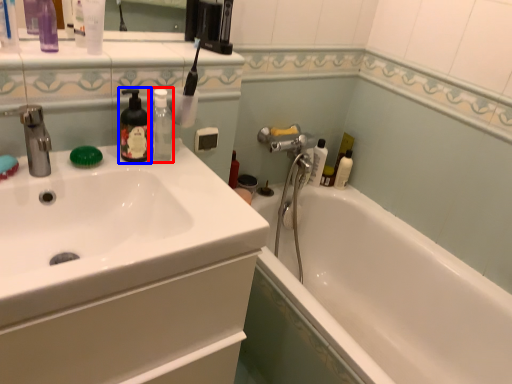
Question: Which object appears closest to the camera in this image, mouthwash (highlighted by a red box) or soap dispenser (highlighted by a blue box)?

Choices:
 (A) mouthwash
 (B) soap dispenser

Answer: (B)